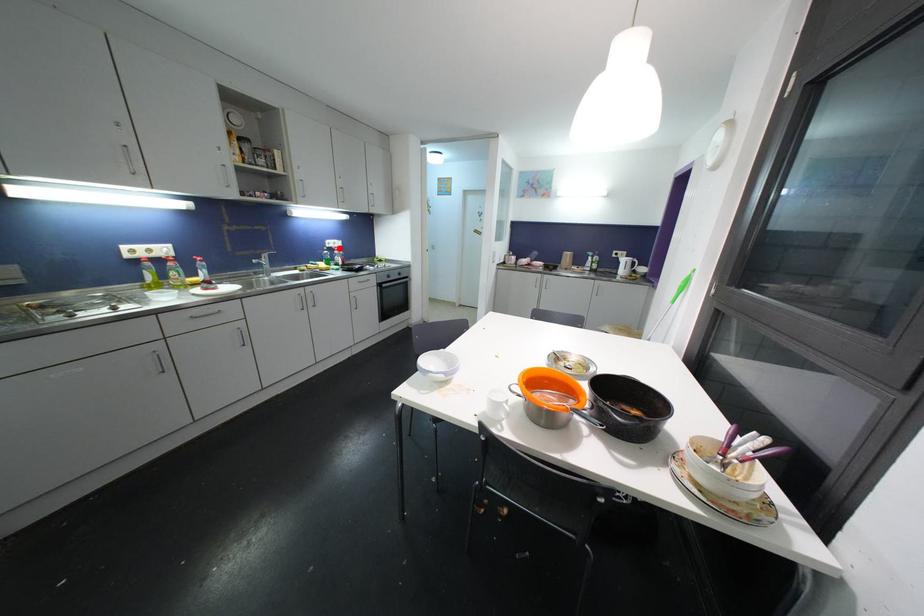
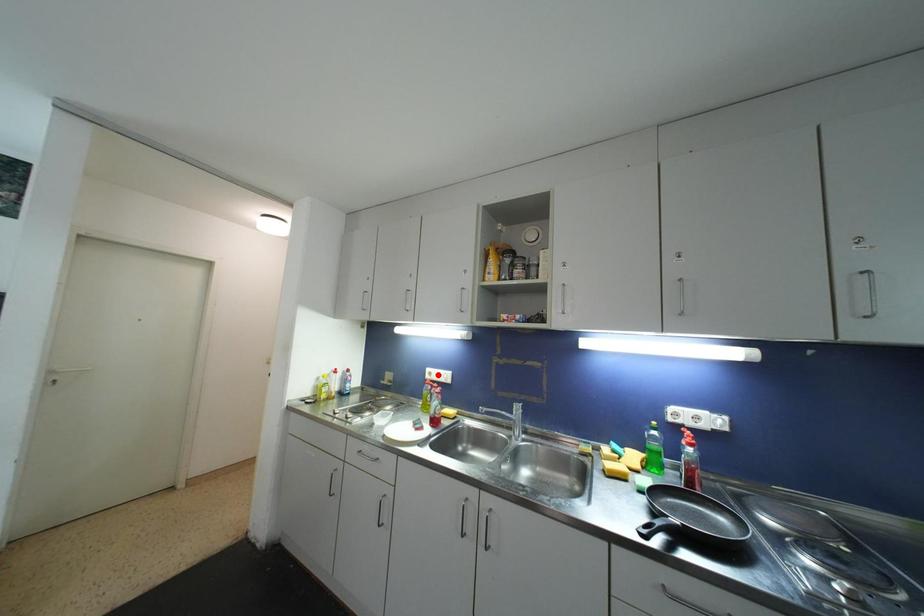
I am providing you with two images of the same scene from different viewpoints. A red point is marked on the first image and another point is marked on the second image. Do the highlighted points in image1 and image2 indicate the same real-world spot?

No